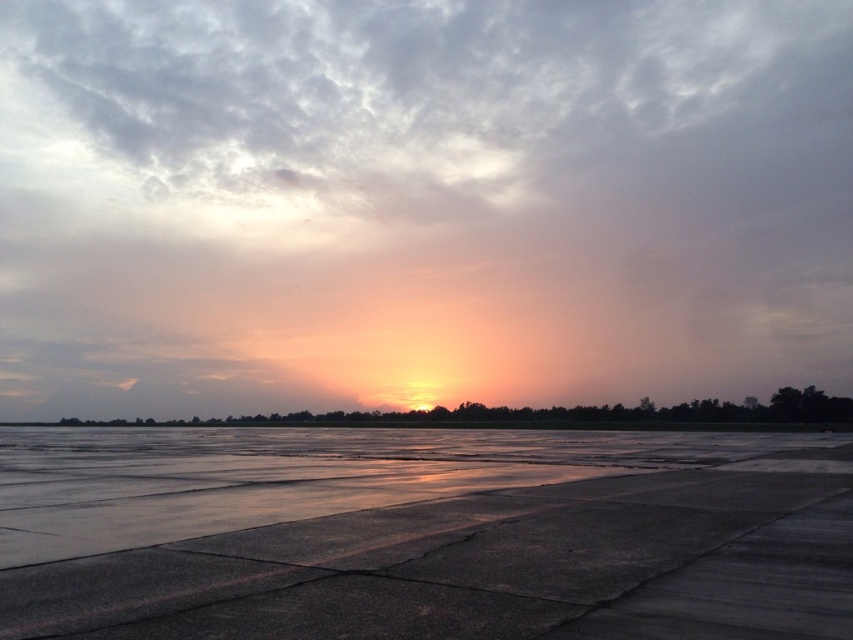
You are standing at the edge of the wet concrete area looking towards the horizon. There are two points marked on the image. The first point is at coordinates point (x=286, y=433) and the second is at point (x=173, y=422). Which point is closer to you?

Point (x=286, y=433) is in front of point (x=173, y=422), so it is closer to you.